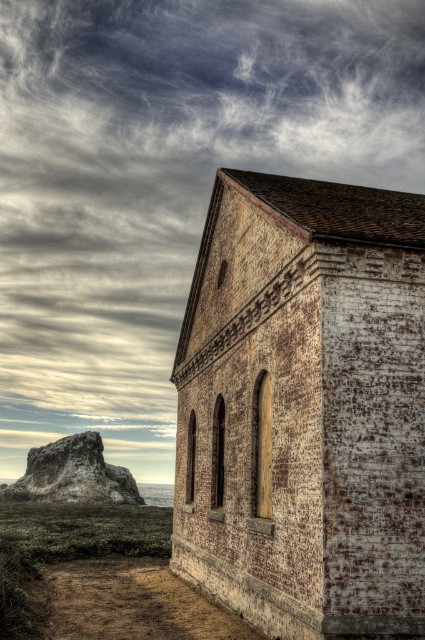
Does rustic brick church at center have a lesser height compared to rustic stone rock at left?

Incorrect, rustic brick church at center's height does not fall short of rustic stone rock at left's.

Does rustic brick church at center have a smaller size compared to rustic stone rock at left?

No.

Is point (266, 308) in front of point (8, 484)?

Yes, it is in front of point (8, 484).

The image size is (425, 640). Identify the location of rustic brick church at center. (303, 406).